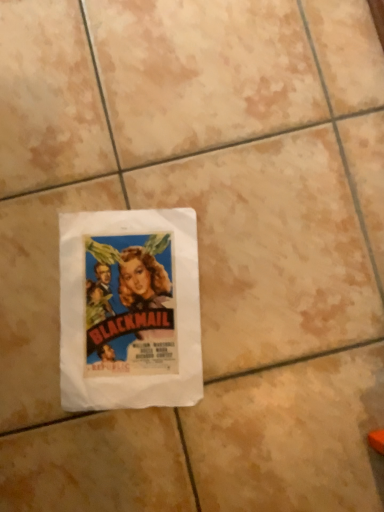
This screenshot has height=512, width=384. Describe the element at coordinates (130, 310) in the screenshot. I see `matte paper poster at center` at that location.

Where is `matte paper poster at center`? matte paper poster at center is located at coordinates (130, 310).

In order to face matte paper poster at center, should I rotate leftwards or rightwards?

You should rotate left by 9.190 degrees.

This screenshot has width=384, height=512. Find the location of `matte paper poster at center`. matte paper poster at center is located at coordinates (130, 310).